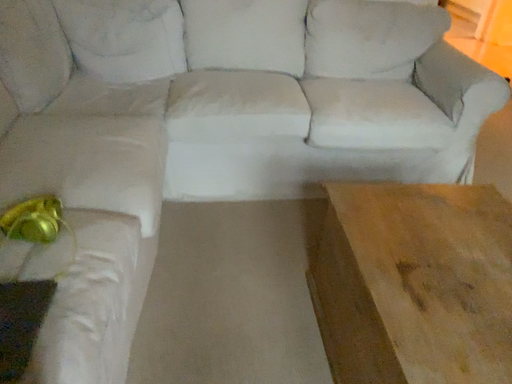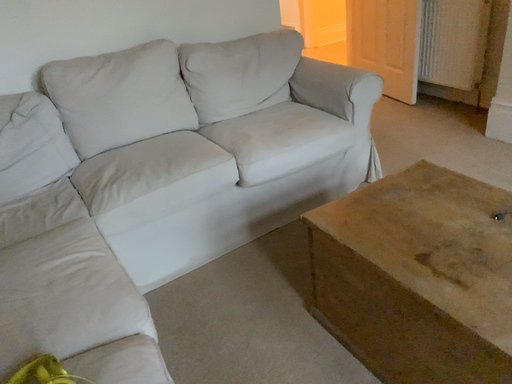
Question: Which way did the camera rotate in the video?

Choices:
 (A) rotated left
 (B) rotated right

Answer: (B)